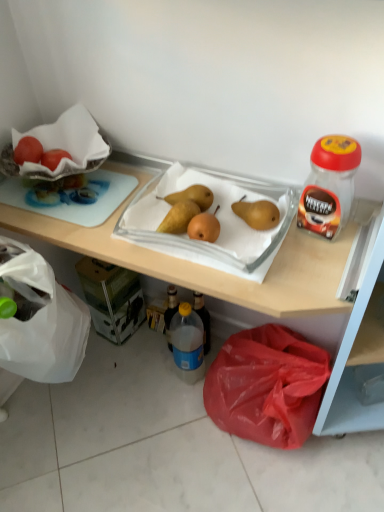
Question: From a real-world perspective, is red plastic bag at lower center on top of matte white grapefruit at upper left?

Choices:
 (A) yes
 (B) no

Answer: (B)

Question: Is red plastic bag at lower center smaller than matte white grapefruit at upper left?

Choices:
 (A) no
 (B) yes

Answer: (A)

Question: From the image's perspective, is red plastic bag at lower center located above matte white grapefruit at upper left?

Choices:
 (A) yes
 (B) no

Answer: (B)

Question: Is red plastic bag at lower center taller than matte white grapefruit at upper left?

Choices:
 (A) no
 (B) yes

Answer: (B)

Question: Is red plastic bag at lower center to the left of matte white grapefruit at upper left from the viewer's perspective?

Choices:
 (A) no
 (B) yes

Answer: (A)

Question: Can matte white grapefruit at upper left be found inside red plastic bag at lower center?

Choices:
 (A) no
 (B) yes

Answer: (A)

Question: Is the depth of matte white grapefruit at upper left less than that of wooden tray at upper center?

Choices:
 (A) no
 (B) yes

Answer: (A)

Question: From a real-world perspective, is matte white grapefruit at upper left positioned over wooden tray at upper center based on gravity?

Choices:
 (A) no
 (B) yes

Answer: (B)

Question: Does matte white grapefruit at upper left have a larger size compared to wooden tray at upper center?

Choices:
 (A) no
 (B) yes

Answer: (A)

Question: Does matte white grapefruit at upper left have a greater width compared to wooden tray at upper center?

Choices:
 (A) yes
 (B) no

Answer: (B)

Question: Can you confirm if matte white grapefruit at upper left is shorter than wooden tray at upper center?

Choices:
 (A) yes
 (B) no

Answer: (A)

Question: Considering the relative positions of matte white grapefruit at upper left and wooden tray at upper center in the image provided, is matte white grapefruit at upper left to the right of wooden tray at upper center from the viewer's perspective?

Choices:
 (A) yes
 (B) no

Answer: (B)

Question: From a real-world perspective, is matte white grapefruit at upper left under red plastic bag at lower center?

Choices:
 (A) no
 (B) yes

Answer: (A)